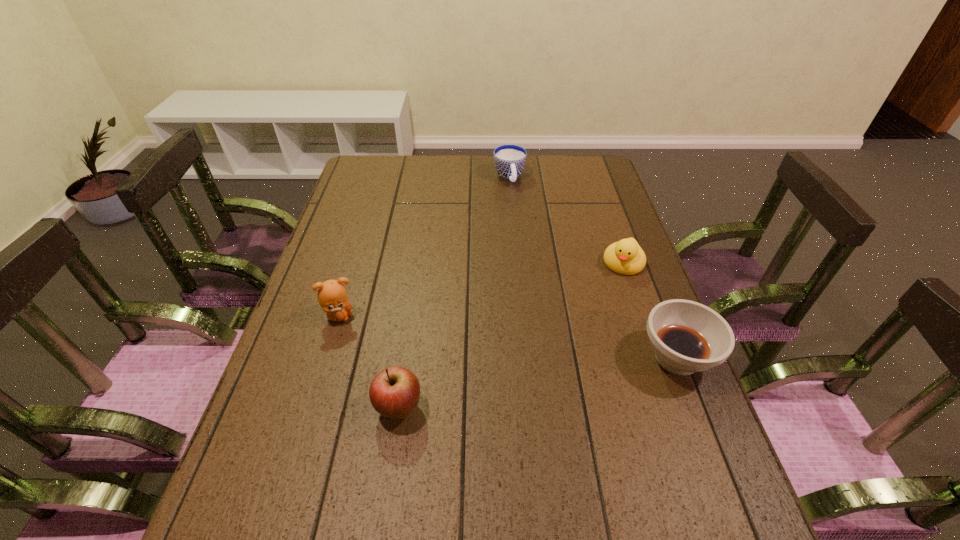
Find the location of a particular element. The width and height of the screenshot is (960, 540). free region located 0.290m on the face of the third nearest object is located at coordinates (462, 350).

Locate an element on the screen. vacant area located on the face of the third nearest object is located at coordinates (486, 357).

I want to click on free point located 0.220m on the face of the duckling, so click(x=593, y=330).

I want to click on vacant space positioned 0.340m on the face of the duckling, so click(x=577, y=366).

Locate an element on the screen. The width and height of the screenshot is (960, 540). vacant space situated 0.320m on the face of the duckling is located at coordinates (580, 360).

At what (x,y) coordinates should I click in order to perform the action: click on free space located on the side of the farthest object with the handle. Please return your answer as a coordinate pair (x, y). Image resolution: width=960 pixels, height=540 pixels. Looking at the image, I should click on coord(518,204).

Locate an element on the screen. blank space located on the side of the farthest object with the handle is located at coordinates (541, 266).

Locate an element on the screen. vacant space located on the side of the farthest object with the handle is located at coordinates (526, 224).

Locate an element on the screen. This screenshot has width=960, height=540. object that is at the far edge is located at coordinates (509, 160).

This screenshot has width=960, height=540. Find the location of `object present at the left edge`. object present at the left edge is located at coordinates (332, 296).